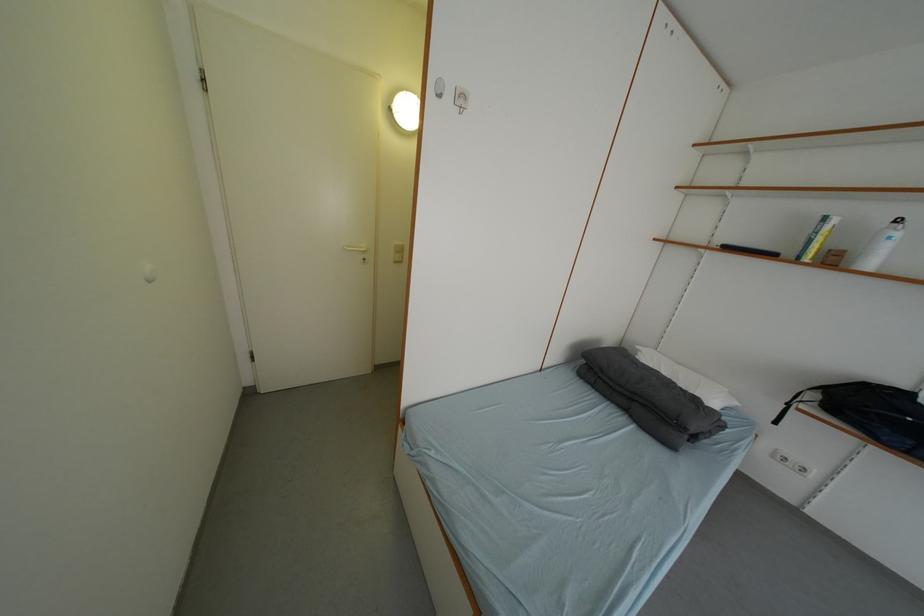
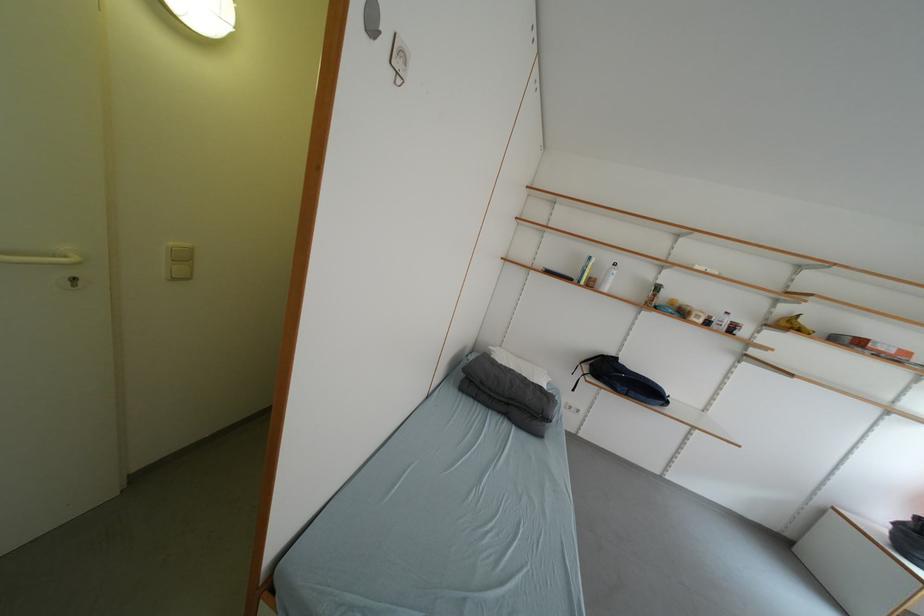
Question: Based on the continuous images, in which direction is the camera rotating? Reply with the corresponding letter.

Choices:
 (A) Left
 (B) Right
 (C) Up
 (D) Down

Answer: (B)